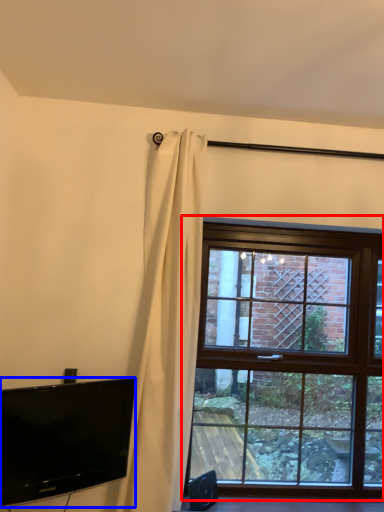
Question: Which object is closer to the camera taking this photo, window (highlighted by a red box) or television (highlighted by a blue box)?

Choices:
 (A) window
 (B) television

Answer: (B)